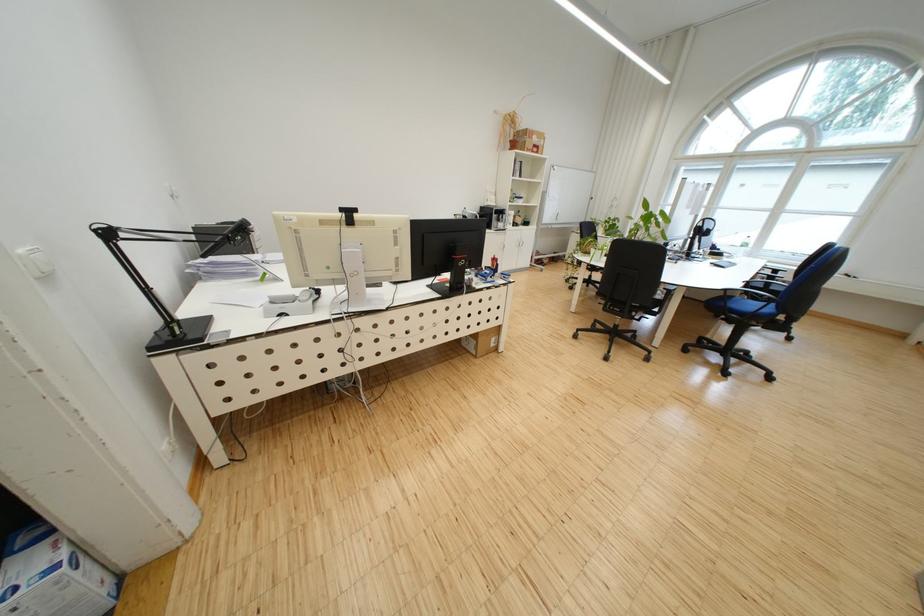
Find where to adjust the black lamp head. Please return your answer as a coordinate pair (x, y).

(225, 238)